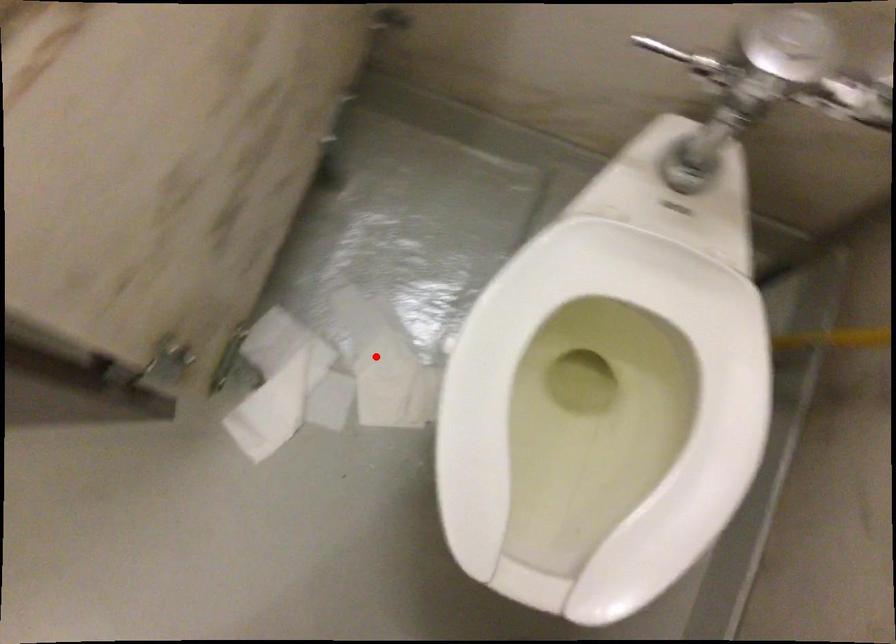
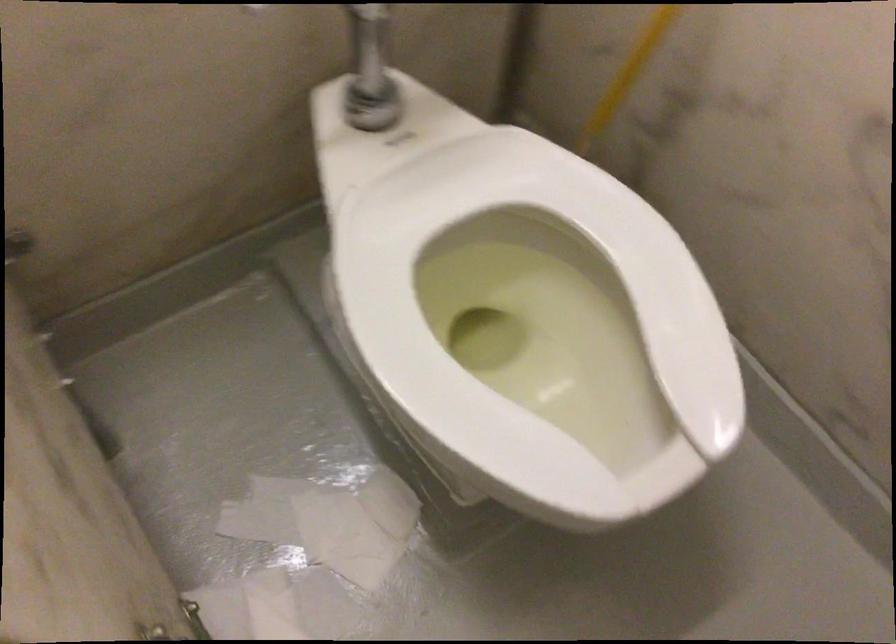
Question: I am providing you with two images of the same scene from different viewpoints. A red point is shown in image1. For the corresponding object point in image2, is it positioned nearer or farther from the camera?

Choices:
 (A) Nearer
 (B) Farther

Answer: (A)